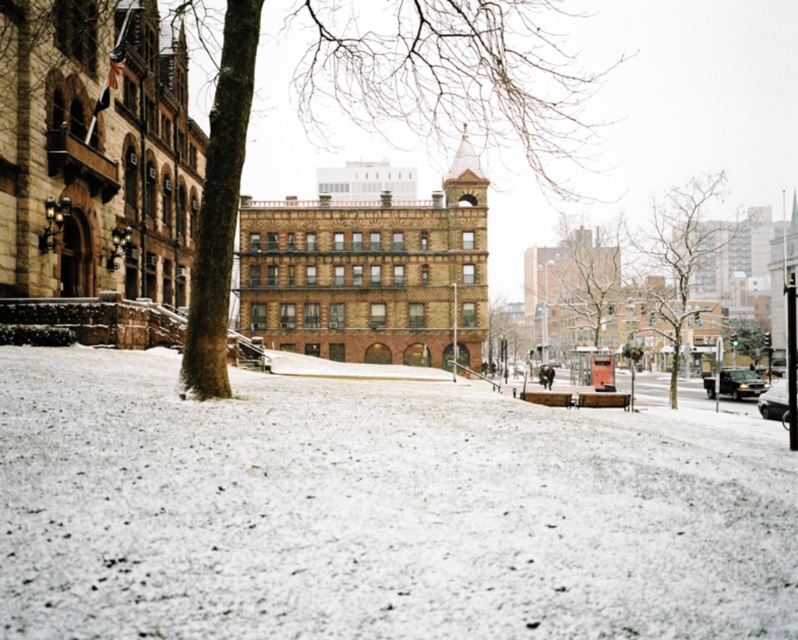
Based on the photo, which is more to the right, white powdery snow at lower center or smooth brown tree at center?

From the viewer's perspective, smooth brown tree at center appears more on the right side.

Does white powdery snow at lower center appear over smooth brown tree at center?

Actually, white powdery snow at lower center is below smooth brown tree at center.

Describe the element at coordinates (377, 509) in the screenshot. I see `white powdery snow at lower center` at that location.

At what (x,y) coordinates should I click in order to perform the action: click on white powdery snow at lower center. Please return your answer as a coordinate pair (x, y). Looking at the image, I should click on (377, 509).

Between white powdery snow at lower center and bare branches at center, which one has less height?

white powdery snow at lower center is shorter.

Is point (583, 481) in front of point (674, 248)?

Yes, point (583, 481) is closer to viewer.

Between point (380, 442) and point (670, 305), which one is positioned in front?

Point (380, 442) is more forward.

Find the location of a particular element. The height and width of the screenshot is (640, 798). white powdery snow at lower center is located at coordinates (377, 509).

This screenshot has width=798, height=640. What are the coordinates of `smooth brown tree at center` in the screenshot? It's located at (571, 289).

I want to click on smooth brown tree at center, so click(571, 289).